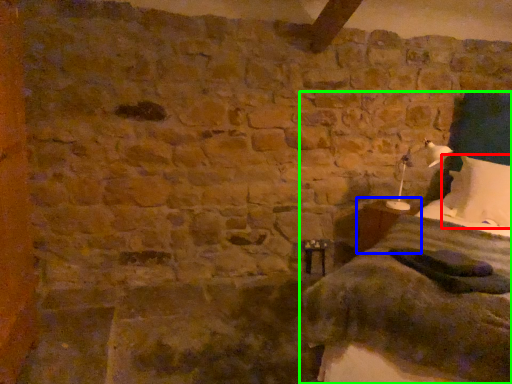
Question: Based on their relative distances, which object is nearer to pillow (highlighted by a red box)? Choose from table (highlighted by a blue box) and bed (highlighted by a green box).

Choices:
 (A) table
 (B) bed

Answer: (B)